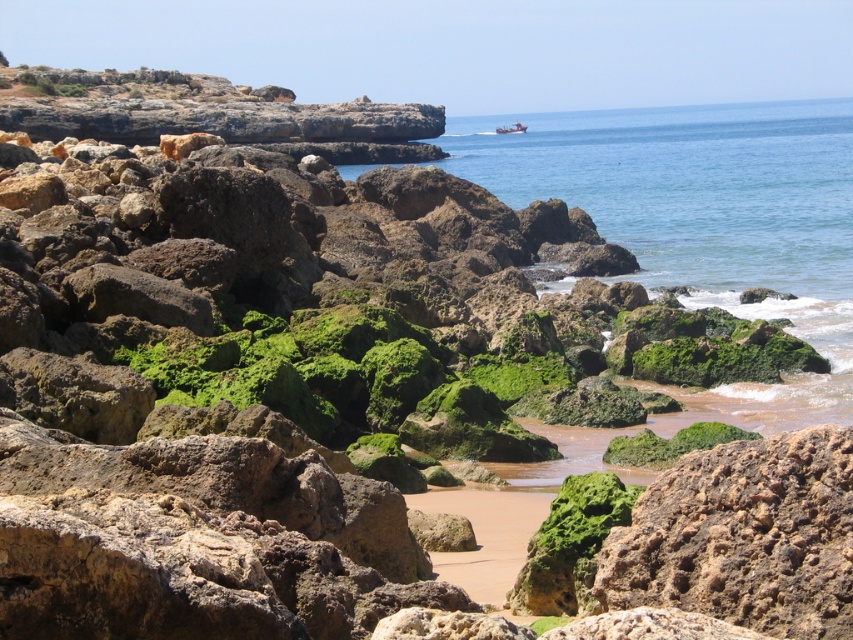
Question: Which of the following is the farthest from the observer?

Choices:
 (A) green mossy rock at center
 (B) metallic red boat at center

Answer: (B)

Question: Among these points, which one is nearest to the camera?

Choices:
 (A) (514, 125)
 (B) (734, 428)

Answer: (B)

Question: Is green mossy rock at center wider than metallic red boat at center?

Choices:
 (A) no
 (B) yes

Answer: (A)

Question: Can you confirm if green mossy rock at center is positioned below metallic red boat at center?

Choices:
 (A) no
 (B) yes

Answer: (B)

Question: Which of the following is the closest to the observer?

Choices:
 (A) (659, 436)
 (B) (518, 124)

Answer: (A)

Question: Can you confirm if green mossy rock at center is positioned to the right of metallic red boat at center?

Choices:
 (A) yes
 (B) no

Answer: (B)